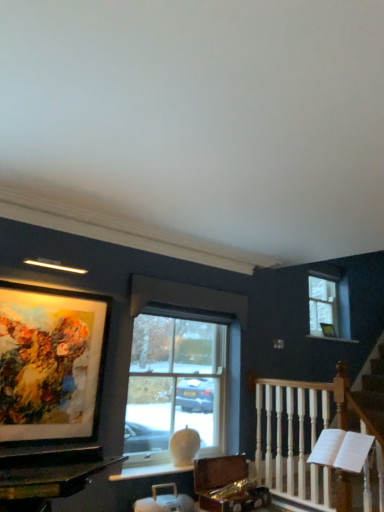
In order to click on free space above matte glass picture frame at upper left (from a real-world perspective) in this screenshot , I will do `click(47, 293)`.